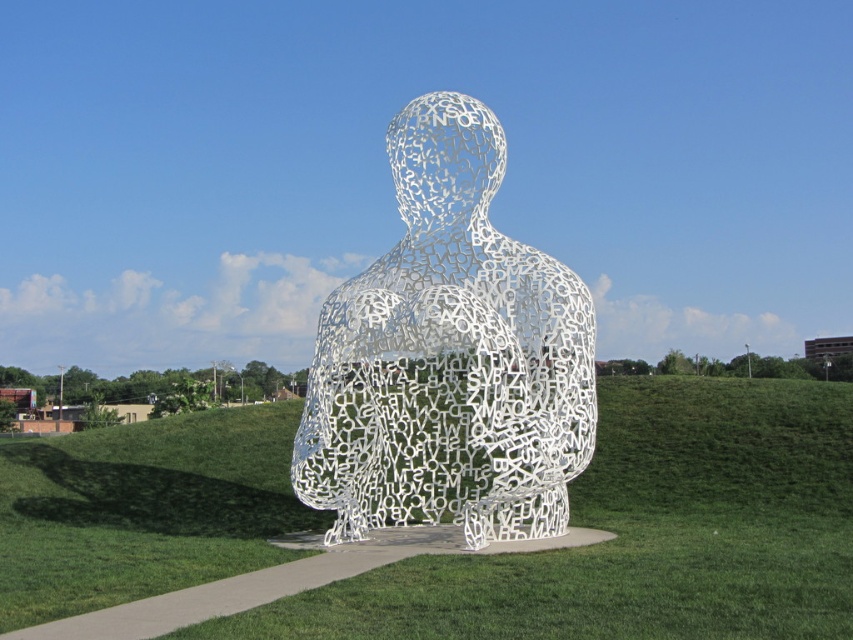
Question: Is green grass at center positioned at the back of white metallic sculpture at center?

Choices:
 (A) yes
 (B) no

Answer: (B)

Question: Is green grass at center wider than white metallic sculpture at center?

Choices:
 (A) yes
 (B) no

Answer: (A)

Question: Which object is closer to the camera taking this photo?

Choices:
 (A) green grass at center
 (B) white metallic sculpture at center

Answer: (A)

Question: Does green grass at center have a smaller size compared to white metallic sculpture at center?

Choices:
 (A) yes
 (B) no

Answer: (B)